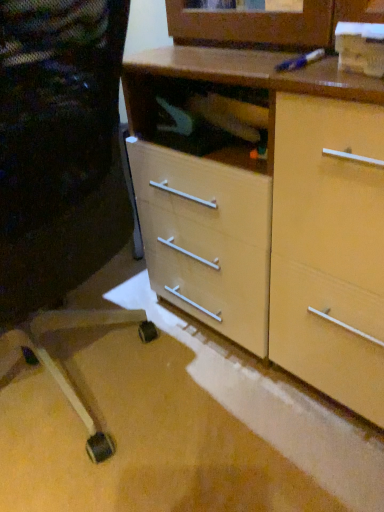
Question: Is matte wood chest of drawers at center taller or shorter than matte black chair at lower left?

Choices:
 (A) short
 (B) tall

Answer: (A)

Question: Considering the positions of point (299, 184) and point (39, 57), is point (299, 184) closer or farther from the camera than point (39, 57)?

Choices:
 (A) farther
 (B) closer

Answer: (A)

Question: Is matte wood chest of drawers at center to the left or to the right of matte black chair at lower left in the image?

Choices:
 (A) right
 (B) left

Answer: (A)

Question: Considering their positions, is matte black chair at lower left located in front of or behind matte wood chest of drawers at center?

Choices:
 (A) behind
 (B) front

Answer: (B)

Question: Is matte black chair at lower left taller or shorter than matte wood chest of drawers at center?

Choices:
 (A) short
 (B) tall

Answer: (B)

Question: Does point (109, 437) appear closer or farther from the camera than point (350, 240)?

Choices:
 (A) farther
 (B) closer

Answer: (A)

Question: From the image's perspective, relative to matte wood chest of drawers at center, is matte black chair at lower left above or below?

Choices:
 (A) above
 (B) below

Answer: (B)